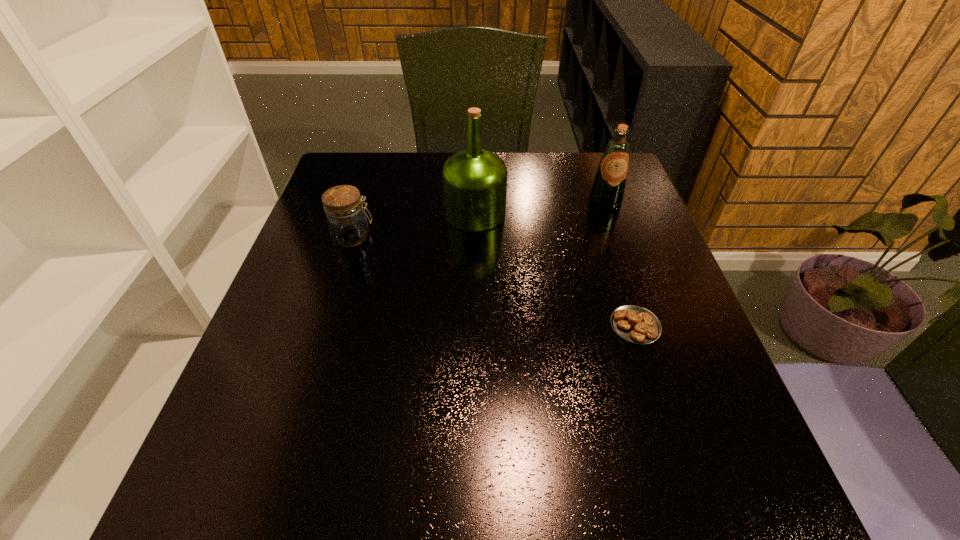
The height and width of the screenshot is (540, 960). I want to click on free location located on the lid of the leftmost object, so click(420, 237).

Where is `vacant space located on the right of the nearest object`? This screenshot has width=960, height=540. vacant space located on the right of the nearest object is located at coordinates (685, 326).

Where is `object present at the left edge`? The height and width of the screenshot is (540, 960). object present at the left edge is located at coordinates (347, 222).

This screenshot has height=540, width=960. Find the location of `olive oil that is at the right edge`. olive oil that is at the right edge is located at coordinates (608, 189).

Locate an element on the screen. pastry present at the right edge is located at coordinates (635, 324).

What are the coordinates of `object present at the far right corner` in the screenshot? It's located at click(608, 189).

In the image, there is a desktop. Where is `vacant area at the far edge`? vacant area at the far edge is located at coordinates (511, 163).

I want to click on blank area at the near edge, so click(x=317, y=488).

This screenshot has height=540, width=960. In the image, there is a desktop. Find the location of `vacant space at the left edge`. vacant space at the left edge is located at coordinates (325, 229).

You are a GUI agent. You are given a task and a screenshot of the screen. Output one action in this format:
    pyautogui.click(x=<x>, y=<y>)
    Task: Click on the free point at the right edge
    Image resolution: width=960 pixels, height=540 pixels.
    Given the screenshot: What is the action you would take?
    pyautogui.click(x=621, y=298)